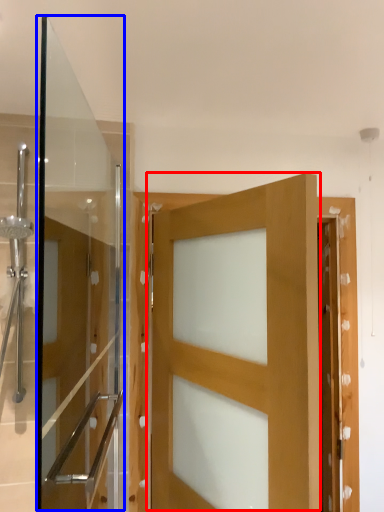
Question: Which of the following is the farthest to the observer, door (highlighted by a red box) or screen door (highlighted by a blue box)?

Choices:
 (A) door
 (B) screen door

Answer: (A)